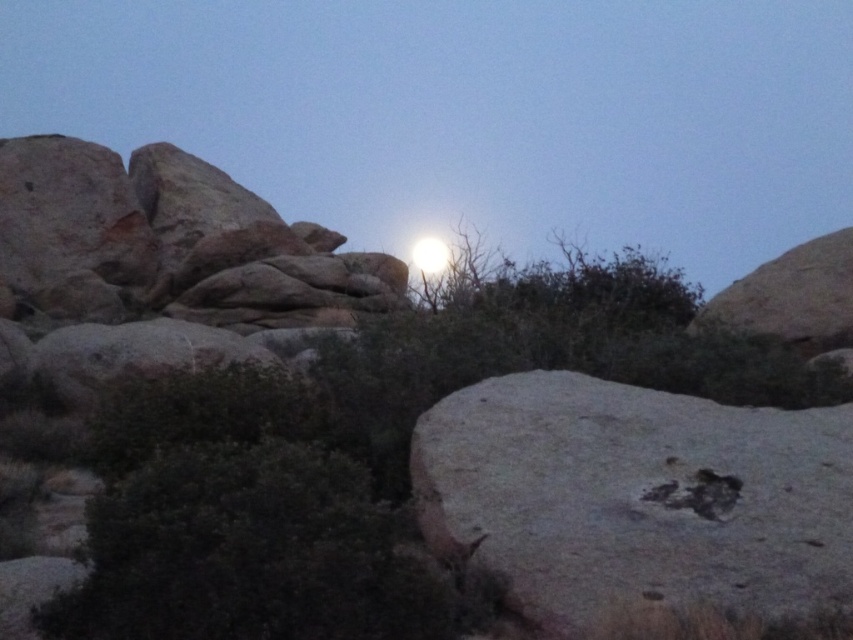
Does smooth rock at center appear on the right side of bright white sphere at upper center?

Incorrect, smooth rock at center is not on the right side of bright white sphere at upper center.

Which is behind, point (402, 106) or point (424, 244)?

Point (402, 106)

Is point (654, 195) positioned in front of point (426, 246)?

That is False.

In order to click on smooth rock at center in this screenshot , I will do `click(473, 113)`.

Who is more distant from viewer, (521, 152) or (532, 484)?

Positioned behind is point (521, 152).

Who is more distant from viewer, (345,32) or (630,548)?

Point (345,32)

Find the location of a particular element. smooth rock at center is located at coordinates (473, 113).

Between point (834, 572) and point (426, 253), which one is positioned in front?

Point (834, 572) is in front.

Does gray rough rock at center appear under bright white sphere at upper center?

Yes.

Is point (460, 541) in front of point (422, 273)?

Yes, it is.

Identify the location of gray rough rock at center. (637, 497).